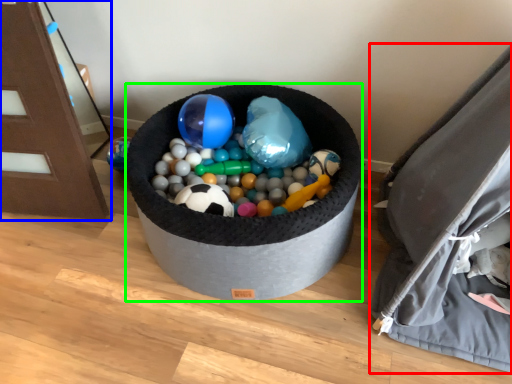
Question: Based on their relative distances, which object is nearer to bean bag chair (highlighted by a red box)? Choose from furniture (highlighted by a blue box) and toy (highlighted by a green box).

Choices:
 (A) furniture
 (B) toy

Answer: (B)